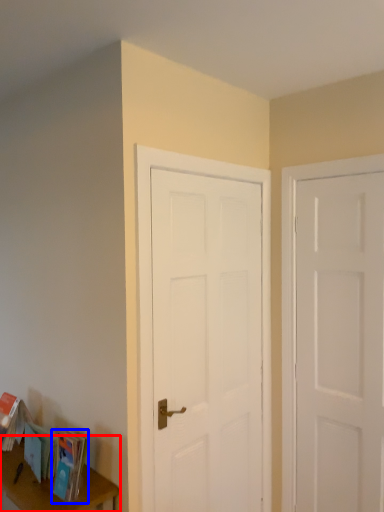
Question: Which of the following is the closest to the observer, table (highlighted by a red box) or paperback book (highlighted by a blue box)?

Choices:
 (A) table
 (B) paperback book

Answer: (A)